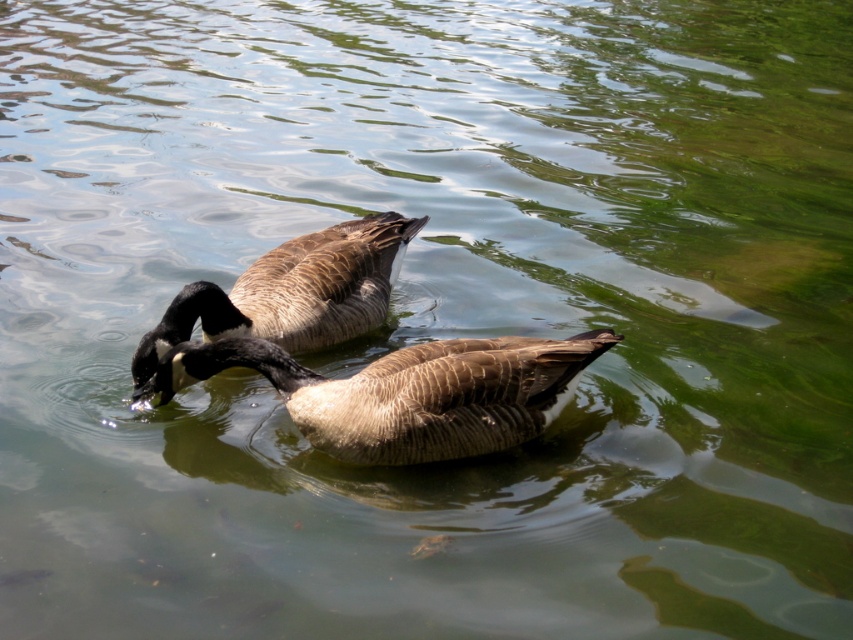
Question: Which point is farther from the camera taking this photo?

Choices:
 (A) (276, 268)
 (B) (270, 348)

Answer: (A)

Question: Can you confirm if brown textured duck at center is smaller than brown feathered duck at center?

Choices:
 (A) no
 (B) yes

Answer: (B)

Question: Which of the following is the farthest from the observer?

Choices:
 (A) brown textured duck at center
 (B) brown feathered duck at center

Answer: (B)

Question: Can you confirm if brown textured duck at center is positioned to the left of brown feathered duck at center?

Choices:
 (A) no
 (B) yes

Answer: (A)

Question: Is brown textured duck at center thinner than brown feathered duck at center?

Choices:
 (A) yes
 (B) no

Answer: (B)

Question: Which object appears farthest from the camera in this image?

Choices:
 (A) brown textured duck at center
 (B) brown feathered duck at center

Answer: (B)